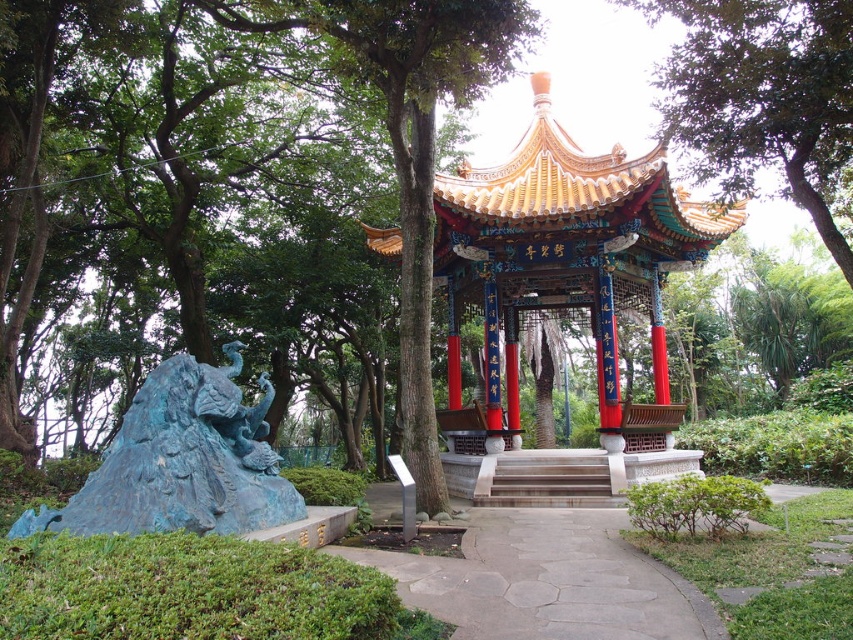
You are a gardener planning to walk along the gray stone path at center while avoiding the blue patina dragon at lower left. Since you need to carry a large gardening tool, which path feature allows you to move comfortably?

The gray stone path at center is wider than the blue patina dragon at lower left, so you can comfortably move along the gray stone path at center with your large gardening tool.

You are a gardener planning to place a new decorative statue on the gray stone path at center. Considering the space available, will the statue fit if it is the same size as the blue patina dragon at lower left?

The gray stone path at center occupies less space than the blue patina dragon at lower left. Therefore, the statue of the same size as the blue patina dragon at lower left would not fit on the gray stone path at center due to insufficient space.

You are planning to take a photo of the green leafy tree at upper center and the smooth stone stairs at center. Which object should you zoom in more on to capture both in the frame without cropping?

Since the green leafy tree at upper center is narrower than the smooth stone stairs at center, you should zoom in more on the smooth stone stairs at center to ensure both fit in the frame without cropping.